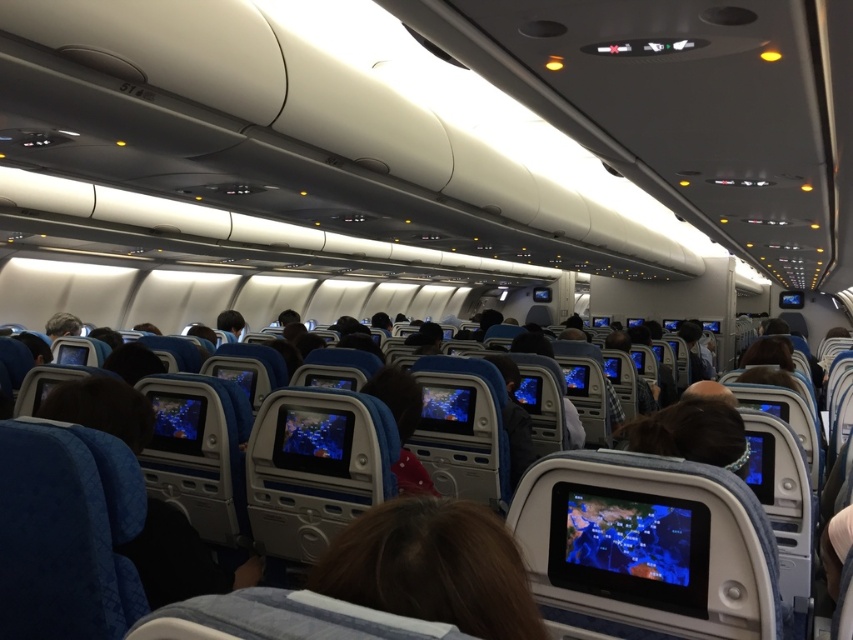
Question: Which point is closer to the camera?

Choices:
 (A) (520, 392)
 (B) (457, 540)

Answer: (B)

Question: Does brown hair at center appear on the left side of blue glossy screen at center?

Choices:
 (A) yes
 (B) no

Answer: (A)

Question: Is brown hair at center wider than blue glossy screen at center?

Choices:
 (A) no
 (B) yes

Answer: (B)

Question: Can you confirm if brown hair at center is positioned above blue glossy screen at center?

Choices:
 (A) yes
 (B) no

Answer: (A)

Question: Which of the following is the closest to the observer?

Choices:
 (A) (519, 394)
 (B) (517, 573)

Answer: (B)